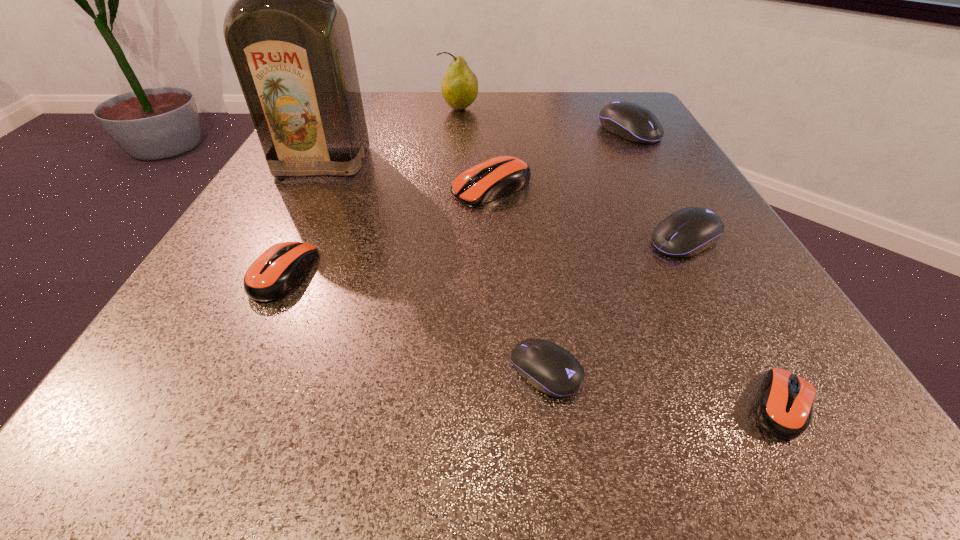
At what (x,y) coordinates should I click in order to perform the action: click on liquor. Please return your answer as a coordinate pair (x, y). This screenshot has width=960, height=540. Looking at the image, I should click on (290, 44).

In order to click on pear in this screenshot , I will do `click(459, 87)`.

Identify the location of the second tallest object. This screenshot has width=960, height=540. (459, 87).

At what (x,y) coordinates should I click in order to perform the action: click on the sixth shortest object. Please return your answer as a coordinate pair (x, y). The width and height of the screenshot is (960, 540). Looking at the image, I should click on (630, 121).

In order to click on the biggest black computer mouse in this screenshot , I will do `click(630, 121)`.

Find the location of a particular element. The image size is (960, 540). the farthest orange computer mouse is located at coordinates (496, 177).

Identify the location of the fifth nearest computer mouse. The height and width of the screenshot is (540, 960). (496, 177).

Where is `the second farthest black computer mouse`? The height and width of the screenshot is (540, 960). the second farthest black computer mouse is located at coordinates (691, 230).

You are a GUI agent. You are given a task and a screenshot of the screen. Output one action in this format:
    pyautogui.click(x=<x>, y=<y>)
    Task: Click on the leftmost orange computer mouse
    This screenshot has height=540, width=960.
    Given the screenshot: What is the action you would take?
    pyautogui.click(x=274, y=273)

Locate an element on the screen. The width and height of the screenshot is (960, 540). the second biggest orange computer mouse is located at coordinates (274, 273).